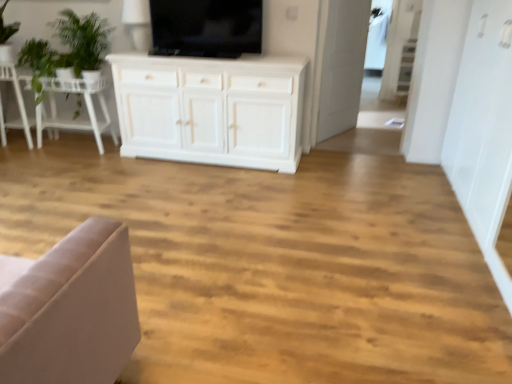
Locate an element on the screen. The image size is (512, 384). green leafy plant at upper left is located at coordinates (83, 38).

Locate an element on the screen. The image size is (512, 384). black glossy tv at upper center is located at coordinates (206, 28).

You are a GUI agent. You are given a task and a screenshot of the screen. Output one action in this format:
    pyautogui.click(x=<x>, y=<y>)
    Task: Click on the white wooden table at left
    Image resolution: width=512 pixels, height=384 pixels.
    Given the screenshot: What is the action you would take?
    pyautogui.click(x=75, y=120)

This screenshot has height=384, width=512. What do you see at coordinates (17, 103) in the screenshot? I see `green fabric chair at left` at bounding box center [17, 103].

Where is `green leafy plant at upper left`? The width and height of the screenshot is (512, 384). green leafy plant at upper left is located at coordinates (83, 38).

Which of these two, white wooden table at left or green fabric chair at left, is smaller?

With smaller size is green fabric chair at left.

Is green fabric chair at left surrounded by white wooden table at left?

No, white wooden table at left does not contain green fabric chair at left.

Which object is closer to the camera, white wooden table at left or green fabric chair at left?

Positioned in front is white wooden table at left.

From the image's perspective, is white wooden table at left beneath green fabric chair at left?

Indeed, from the image's perspective, white wooden table at left is shown beneath green fabric chair at left.

Which is less distant, (x=61, y=122) or (x=385, y=50)?

Point (x=61, y=122) is positioned closer to the camera compared to point (x=385, y=50).

Is white wooden table at left looking in the opposite direction of transparent glass door at upper right?

No, white wooden table at left is not facing away from transparent glass door at upper right.

Can you confirm if white wooden table at left is smaller than transparent glass door at upper right?

No.

Relative to transparent glass door at upper right, is white wooden table at left in front or behind?

Clearly, white wooden table at left is in front of transparent glass door at upper right.

In the scene shown: Visually, is transparent glass door at upper right positioned to the left or to the right of green leafy plant at upper left?

In the image, transparent glass door at upper right appears on the right side of green leafy plant at upper left.

Who is bigger, transparent glass door at upper right or green leafy plant at upper left?

green leafy plant at upper left.

Considering the relative positions of transparent glass door at upper right and green leafy plant at upper left in the image provided, is transparent glass door at upper right in front of green leafy plant at upper left?

No, transparent glass door at upper right is further to the viewer.

Can you confirm if green fabric chair at left is wider than green leafy plant at upper left?

No.

Who is bigger, green fabric chair at left or green leafy plant at upper left?

Bigger between the two is green leafy plant at upper left.

Is green fabric chair at left with green leafy plant at upper left?

No, green fabric chair at left is not in contact with green leafy plant at upper left.

Is green fabric chair at left positioned beyond the bounds of green leafy plant at upper left?

Yes, green fabric chair at left is located beyond the bounds of green leafy plant at upper left.

Where is `glass door located behind the white wooden table at left`? This screenshot has width=512, height=384. glass door located behind the white wooden table at left is located at coordinates (376, 46).

From a real-world perspective, which object stands above the other?

In real-world perspective, transparent glass door at upper right is above.

Does point (384, 56) appear closer or farther from the camera than point (40, 134)?

Point (384, 56).

Which of these two, transparent glass door at upper right or white wooden table at left, is thinner?

transparent glass door at upper right is thinner.

Where is `plant below the black glossy tv at upper center (from the image's perspective)`? The height and width of the screenshot is (384, 512). plant below the black glossy tv at upper center (from the image's perspective) is located at coordinates (83, 38).

Between point (187, 6) and point (82, 18), which one is positioned behind?

Positioned behind is point (82, 18).

Looking at this image, is green leafy plant at upper left at the back of black glossy tv at upper center?

No.

How many degrees apart are the facing directions of transparent glass door at upper right and green fabric chair at left?

There is a 2-degree angle between the facing directions of transparent glass door at upper right and green fabric chair at left.

Are transparent glass door at upper right and green fabric chair at left located far from each other?

Yes, transparent glass door at upper right and green fabric chair at left are quite far apart.

Does transparent glass door at upper right appear on the left side of green fabric chair at left?

In fact, transparent glass door at upper right is to the right of green fabric chair at left.

Locate an element on the screen. This screenshot has height=384, width=512. chair on the left of white wooden table at left is located at coordinates (17, 103).

Where is `glass door that is behind the white wooden table at left`? This screenshot has width=512, height=384. glass door that is behind the white wooden table at left is located at coordinates (376, 46).

From the image, which object appears to be nearer to transparent glass door at upper right, white wooden table at left or green fabric chair at left?

white wooden table at left is positioned closer to the anchor transparent glass door at upper right.

Considering their positions, is green leafy plant at upper left positioned closer to black glossy tv at upper center than white wooden table at left?

green leafy plant at upper left is closer to black glossy tv at upper center.

Estimate the real-world distances between objects in this image. Which object is closer to black glossy tv at upper center, white wooden table at left or green leafy plant at upper left?

green leafy plant at upper left.

Considering their positions, is white wooden table at left positioned further to green leafy plant at upper left than green fabric chair at left?

Based on the image, green fabric chair at left appears to be further to green leafy plant at upper left.

When comparing their distances from transparent glass door at upper right, does white wooden table at left or black glossy tv at upper center seem closer?

black glossy tv at upper center lies closer to transparent glass door at upper right than the other object.

Estimate the real-world distances between objects in this image. Which object is further from black glossy tv at upper center, green fabric chair at left or green leafy plant at upper left?

The object further to black glossy tv at upper center is green fabric chair at left.

From the image, which object appears to be farther from white wooden table at left, green leafy plant at upper left or transparent glass door at upper right?

transparent glass door at upper right is further to white wooden table at left.

Estimate the real-world distances between objects in this image. Which object is closer to black glossy tv at upper center, green leafy plant at upper left or transparent glass door at upper right?

The object closer to black glossy tv at upper center is green leafy plant at upper left.

Locate an element on the screen. The height and width of the screenshot is (384, 512). table between green fabric chair at left and black glossy tv at upper center from left to right is located at coordinates (75, 120).

Where is `plant situated between white wooden table at left and black glossy tv at upper center from left to right`? The width and height of the screenshot is (512, 384). plant situated between white wooden table at left and black glossy tv at upper center from left to right is located at coordinates (83, 38).

Find the location of a particular element. This screenshot has width=512, height=384. table located between green fabric chair at left and green leafy plant at upper left in the left-right direction is located at coordinates (75, 120).

You are a GUI agent. You are given a task and a screenshot of the screen. Output one action in this format:
    pyautogui.click(x=<x>, y=<y>)
    Task: Click on the table between green fabric chair at left and transparent glass door at upper right
    This screenshot has width=512, height=384.
    Given the screenshot: What is the action you would take?
    pyautogui.click(x=75, y=120)